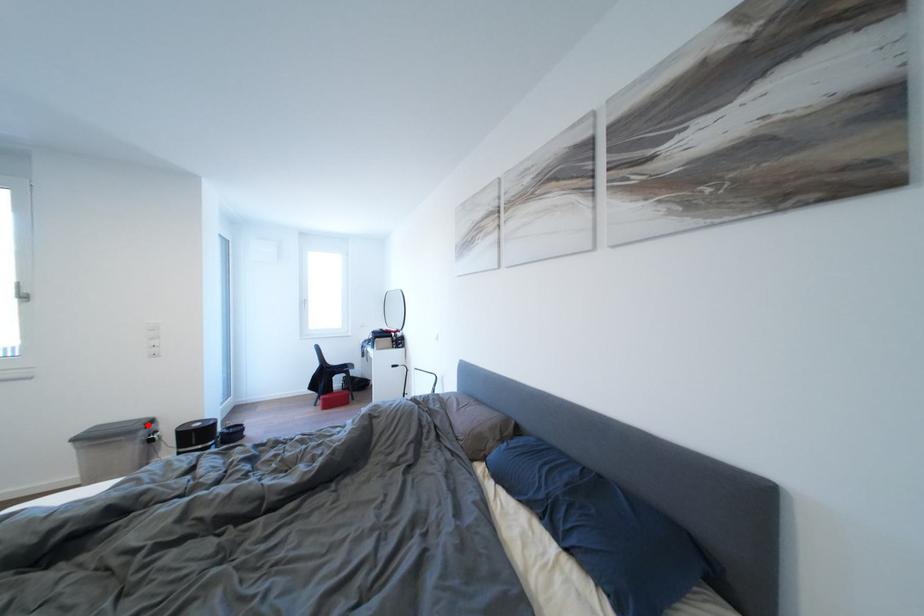
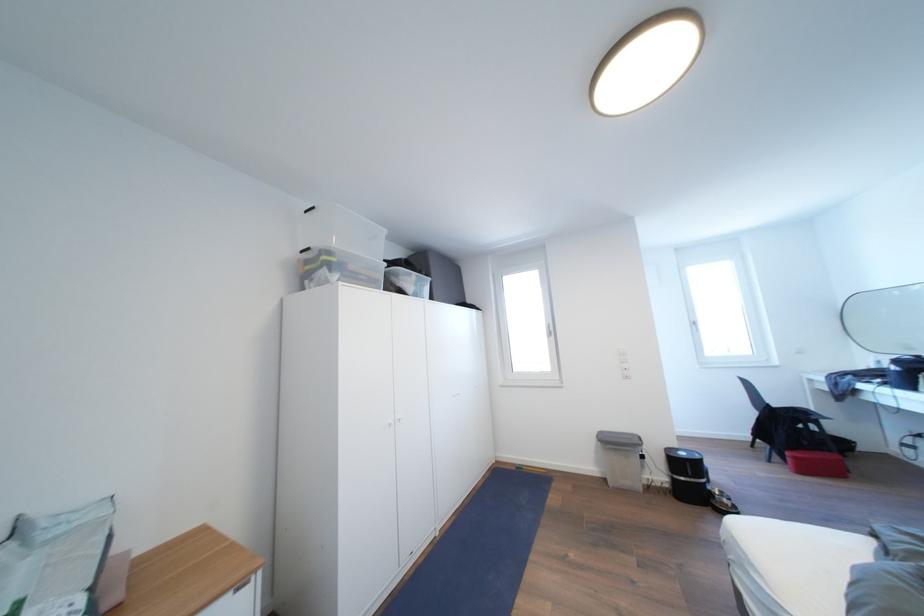
Question: I am providing you with two images of the same scene from different viewpoints. Given a red point in image1, look at the same physical point in image2. Is it:

Choices:
 (A) Closer to the viewpoint
 (B) Farther from the viewpoint

Answer: (B)